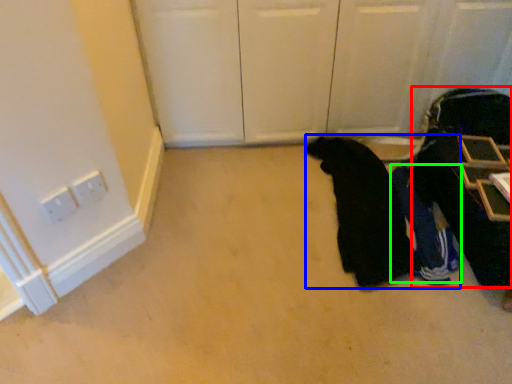
Question: Which object is positioned closest to luggage (highlighted by a red box)? Select from person (highlighted by a blue box) and person (highlighted by a green box).

Choices:
 (A) person
 (B) person

Answer: (B)